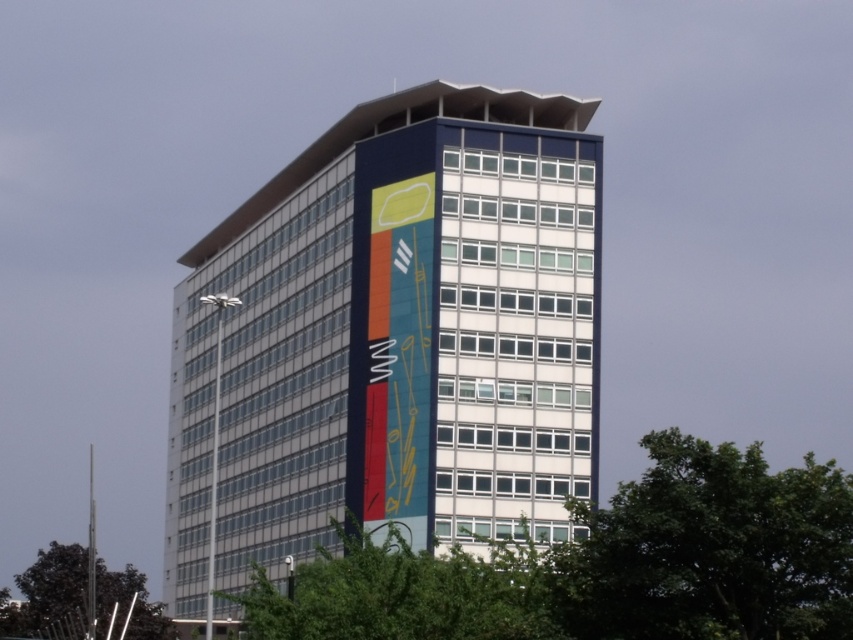
Does green leafy tree at center have a larger size compared to green leafy tree at lower left?

Actually, green leafy tree at center might be smaller than green leafy tree at lower left.

Is green leafy tree at center to the left of green leafy tree at lower left from the viewer's perspective?

In fact, green leafy tree at center is to the right of green leafy tree at lower left.

Measure the distance between point [343,557] and camera.

Point [343,557] is 63.00 meters from camera.

Locate an element on the screen. This screenshot has width=853, height=640. green leafy tree at center is located at coordinates pos(399,593).

Is blue glossy building at center behind green leafy tree at lower left?

No.

Between blue glossy building at center and green leafy tree at lower left, which one is positioned higher?

blue glossy building at center is above.

Who is more distant from viewer, [206,456] or [82,625]?

Positioned behind is point [206,456].

Identify the location of blue glossy building at center. Image resolution: width=853 pixels, height=640 pixels. (392, 339).

Which is above, green leafy tree at lower right or green leafy tree at lower left?

green leafy tree at lower right

Who is more distant from viewer, (779,573) or (18,576)?

The point (18,576) is behind.

Locate an element on the screen. The image size is (853, 640). green leafy tree at lower right is located at coordinates (711, 548).